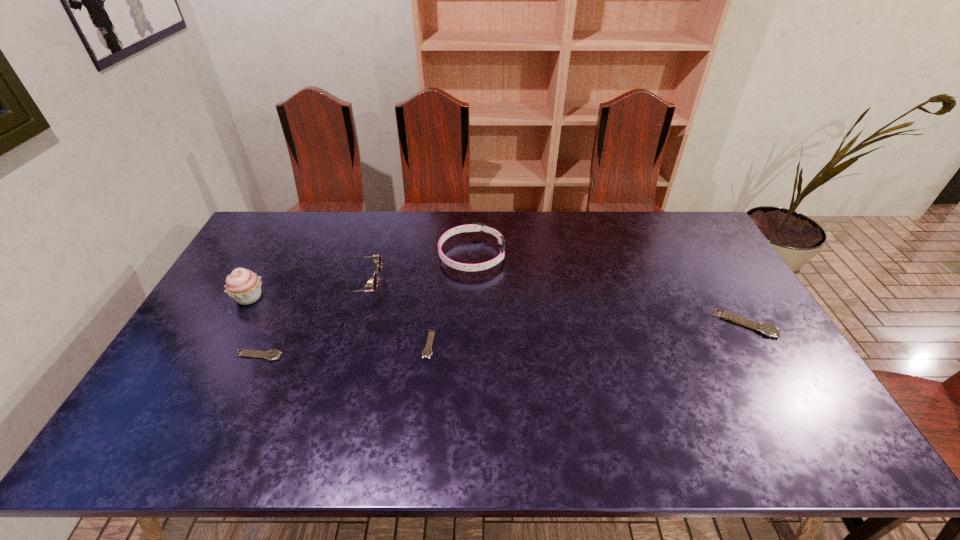
Locate an element on the screen. the leftmost watch is located at coordinates (271, 355).

Locate an element on the screen. The height and width of the screenshot is (540, 960). the second shortest watch is located at coordinates (271, 355).

I want to click on the shortest object, so click(427, 352).

Find the location of a particular element. The height and width of the screenshot is (540, 960). the second watch from left to right is located at coordinates (427, 352).

Identify the location of the rightmost object. The height and width of the screenshot is (540, 960). (767, 329).

Image resolution: width=960 pixels, height=540 pixels. What are the coordinates of `the tallest watch` in the screenshot? It's located at (767, 329).

Where is `the third tallest object`? This screenshot has width=960, height=540. the third tallest object is located at coordinates (475, 226).

Find the location of a particular element. the third object from left to right is located at coordinates (377, 259).

You are a GUI agent. You are given a task and a screenshot of the screen. Output one action in this format:
    pyautogui.click(x=<x>, y=<y>)
    Task: Click on the sunglasses
    
    Given the screenshot: What is the action you would take?
    pyautogui.click(x=377, y=259)

At what (x,y) coordinates should I click in order to perform the action: click on cupcake. Please return your answer as a coordinate pair (x, y). This screenshot has width=960, height=540. Looking at the image, I should click on (244, 286).